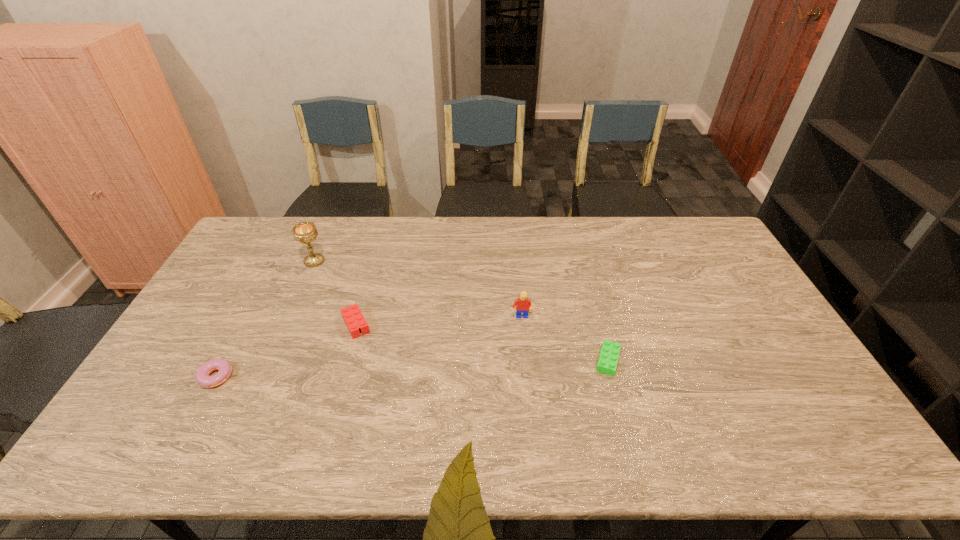
The width and height of the screenshot is (960, 540). What are the coordinates of `the second object from left to right` in the screenshot? It's located at (305, 232).

Locate an element on the screen. The height and width of the screenshot is (540, 960). chalice is located at coordinates (305, 232).

Identify the location of the second tallest object. Image resolution: width=960 pixels, height=540 pixels. (523, 304).

In order to click on the tallest Lego in this screenshot , I will do `click(523, 304)`.

Locate an element on the screen. the third object from right to left is located at coordinates (352, 315).

In order to click on the rightmost object in this screenshot , I will do `click(607, 363)`.

The width and height of the screenshot is (960, 540). Find the location of `the nearest Lego`. the nearest Lego is located at coordinates (607, 363).

The height and width of the screenshot is (540, 960). Identify the location of the leftmost object. (202, 374).

Find the location of a particular element. vacant space situated on the front of the farthest object is located at coordinates (277, 347).

This screenshot has height=540, width=960. I want to click on free space located on the front-facing side of the fourth object from left to right, so click(x=533, y=449).